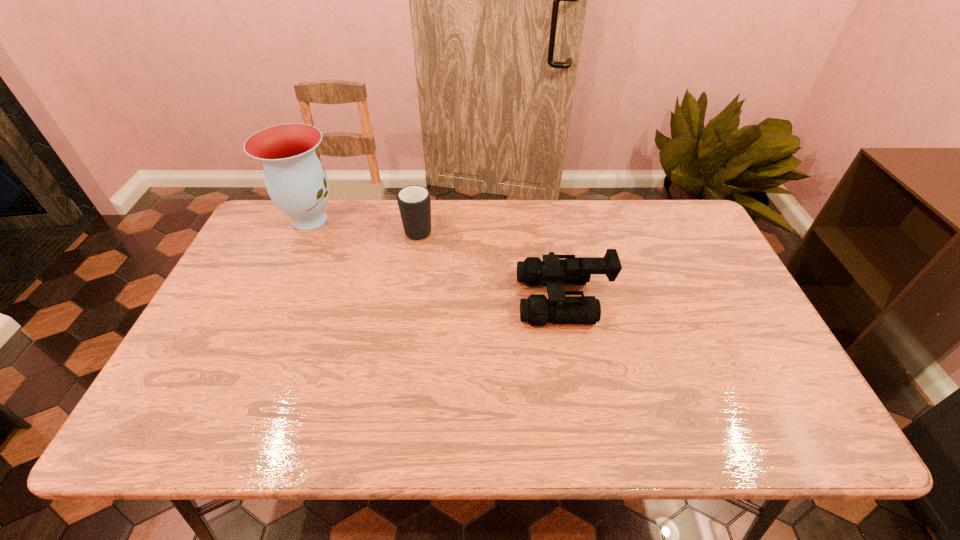
You are a GUI agent. You are given a task and a screenshot of the screen. Output one action in this format:
    pyautogui.click(x=<x>, y=<y>)
    Task: Click on the mug at the far edge
    
    Given the screenshot: What is the action you would take?
    pyautogui.click(x=414, y=201)

The height and width of the screenshot is (540, 960). Identify the location of object that is at the left edge. pyautogui.click(x=296, y=181).

This screenshot has height=540, width=960. What are the coordinates of `object that is at the far left corner` in the screenshot? It's located at (296, 181).

The width and height of the screenshot is (960, 540). I want to click on free space at the far edge, so (622, 200).

At what (x,y) coordinates should I click in order to perform the action: click on vacant region at the left edge of the desktop. Please return your answer as a coordinate pair (x, y). The image size is (960, 540). Looking at the image, I should click on (263, 295).

Identify the location of vacant region at the right edge of the desktop. (693, 293).

This screenshot has height=540, width=960. Identify the location of vacant region at the far right corner. (679, 218).

In the image, there is a desktop. Where is `vacant space at the near right corner`? The height and width of the screenshot is (540, 960). vacant space at the near right corner is located at coordinates pos(806,411).

You are a GUI agent. You are given a task and a screenshot of the screen. Output one action in this format:
    pyautogui.click(x=<x>, y=<y>)
    Task: Click on the vacant point located between the tallest object and the second object from left to right
    
    Given the screenshot: What is the action you would take?
    pyautogui.click(x=364, y=224)

What are the coordinates of `empty location between the second object from right to left and the vase` in the screenshot? It's located at click(364, 224).